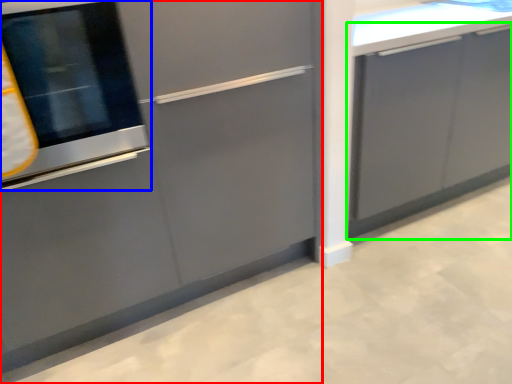
Question: Which object is the farthest from cabinetry (highlighted by a red box)? Choose among these: oven (highlighted by a blue box) or cabinetry (highlighted by a green box).

Choices:
 (A) oven
 (B) cabinetry

Answer: (B)